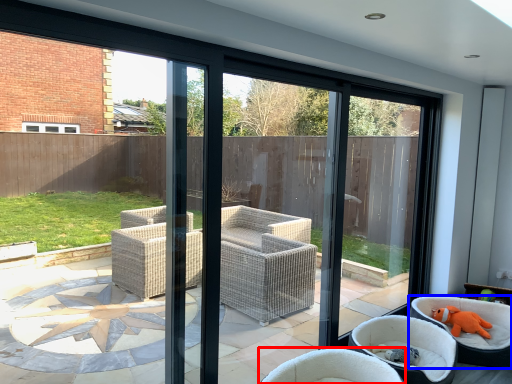
Question: Which point is further to the camera, chair (highlighted by a red box) or chair (highlighted by a blue box)?

Choices:
 (A) chair
 (B) chair

Answer: (B)